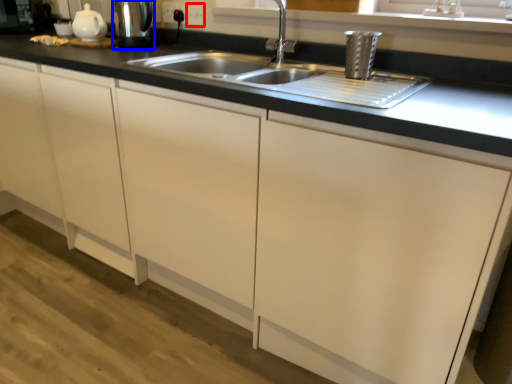
Question: Which object is closer to the camera taking this photo, electric outlet (highlighted by a red box) or appliance (highlighted by a blue box)?

Choices:
 (A) electric outlet
 (B) appliance

Answer: (B)